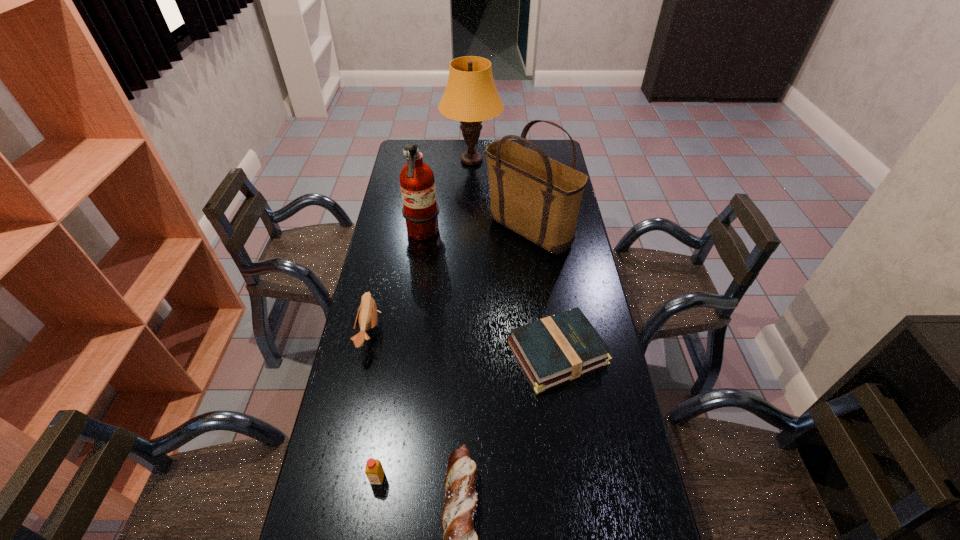
In the image, there is a desktop. Identify the location of vacant space at the far left corner. The image size is (960, 540). (401, 139).

Where is `free space between the orange juice and the farthest object`? free space between the orange juice and the farthest object is located at coordinates point(424,319).

Identify the location of vacant area that lies between the fire extinguisher and the orange juice. The image size is (960, 540). (400, 356).

Find the location of `free space that is in between the hardback book and the fifth tallest object`. free space that is in between the hardback book and the fifth tallest object is located at coordinates (468, 415).

This screenshot has height=540, width=960. Identify the location of free space between the fire extinguisher and the hardback book. (490, 293).

I want to click on object that is the third closest one to the farthest object, so click(x=367, y=316).

Identify which object is the fifth closest to the hardback book. Please provide its 2D coordinates. Your answer should be formatted as a tuple, i.e. [(x, y)], where the tuple contains the x and y coordinates of a point satisfying the conditions above.

[(367, 316)]

I want to click on free space that satisfies the following two spatial constraints: 1. on the front side of the hardback book; 2. on the left side of the lampshade, so click(x=468, y=353).

Locate an element on the screen. The height and width of the screenshot is (540, 960). free space that satisfies the following two spatial constraints: 1. on the nozzle and handle of the fire extinguisher; 2. on the front and back of the orange juice is located at coordinates (389, 478).

The width and height of the screenshot is (960, 540). Find the location of `free spot that satisfies the following two spatial constraints: 1. at the beak of the leftmost object; 2. on the left side of the hardback book`. free spot that satisfies the following two spatial constraints: 1. at the beak of the leftmost object; 2. on the left side of the hardback book is located at coordinates (365, 353).